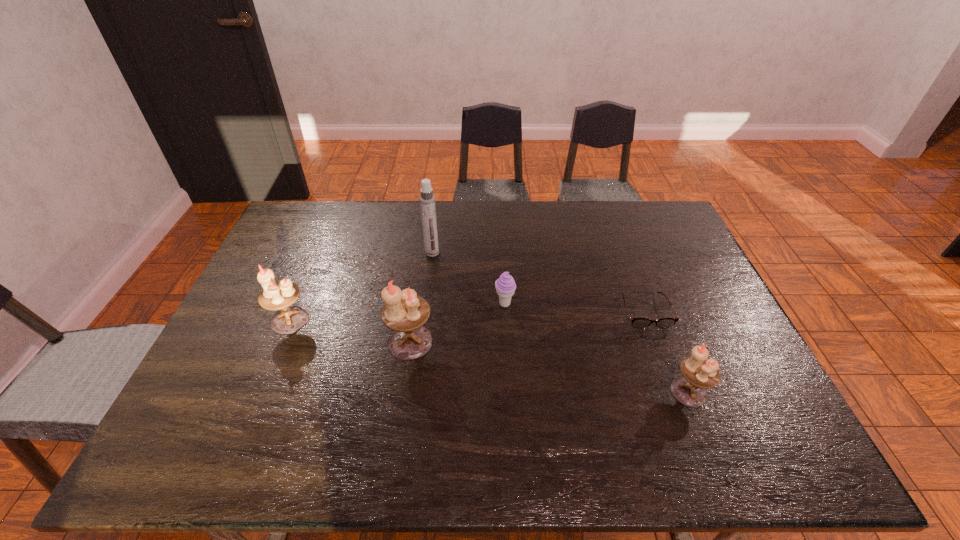
Find the location of a particular element. The image size is (960, 540). free space at the far edge of the desktop is located at coordinates (514, 238).

Find the location of a particular element. free space at the near edge of the desktop is located at coordinates (271, 405).

This screenshot has height=540, width=960. Identify the location of vacant region at the left edge. (232, 371).

At what (x,y) coordinates should I click in order to perform the action: click on vacant space at the right edge of the desktop. Please return your answer as a coordinate pair (x, y). The width and height of the screenshot is (960, 540). Looking at the image, I should click on (693, 285).

Identify the location of free space at the far left corner of the desktop. The width and height of the screenshot is (960, 540). (313, 239).

Identify the location of free spot between the nearest candle holder and the second candle holder from right to left. The width and height of the screenshot is (960, 540). 550,367.

What are the coordinates of `vacant region between the shortest candle holder and the fourth shortest object` in the screenshot? It's located at (490, 356).

You are a GUI agent. You are given a task and a screenshot of the screen. Output one action in this format:
    pyautogui.click(x=<x>, y=<y>)
    Task: Click on the vacant region between the fifth tallest object and the aerosol can
    
    Given the screenshot: What is the action you would take?
    pyautogui.click(x=468, y=279)

Locate an element on the screen. This screenshot has width=960, height=540. vacant space in between the icecream and the shortest object is located at coordinates (574, 308).

This screenshot has width=960, height=540. Identify the location of vacant space that's between the second candle holder from right to left and the second shortest candle holder. (350, 331).